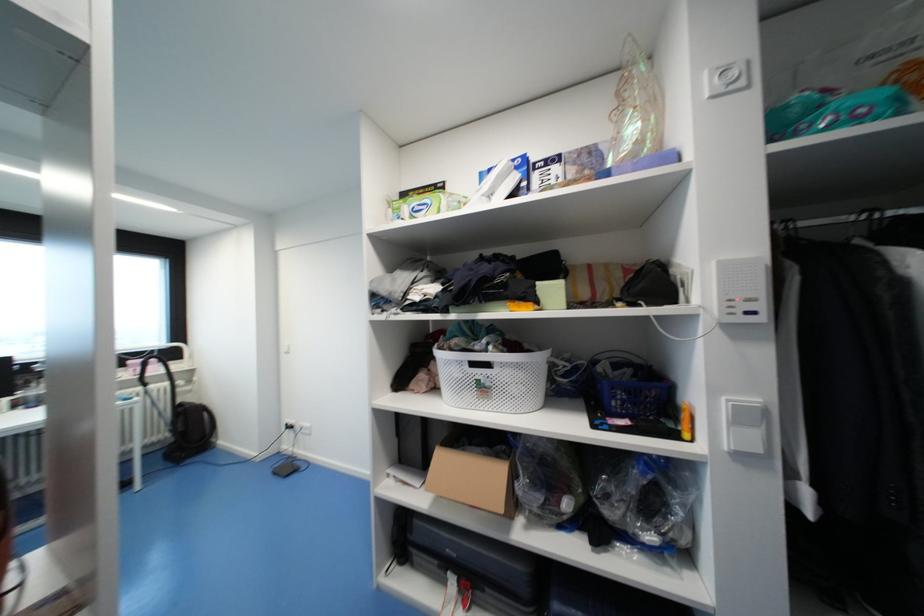
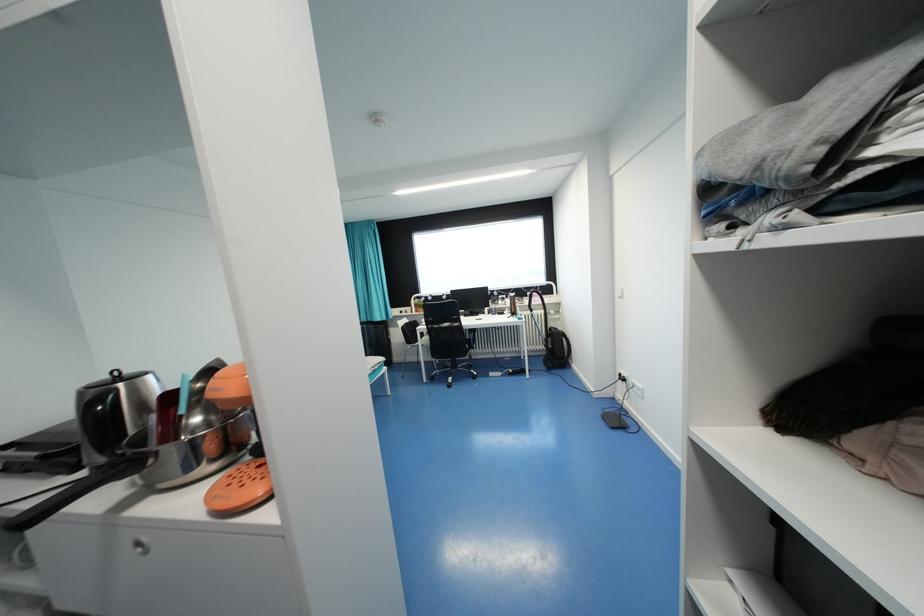
Question: The first image is from the beginning of the video and the second image is from the end. How did the camera likely rotate when shooting the video?

Choices:
 (A) Left
 (B) Right
 (C) Up
 (D) Down

Answer: (A)